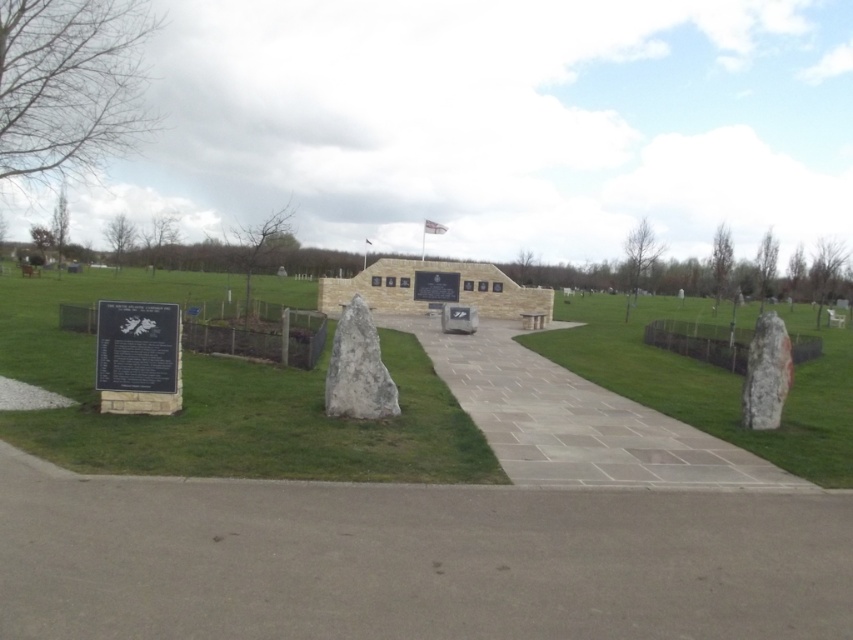
You are a gardener planning to mow the green grass at center and the gray stone path at center. Which area requires mowing?

The green grass at center requires mowing since it is taller than the gray stone path at center, which is likely a paved area and doesn

You are planning to place a small garden ornament that requires a 2 square meter space. Based on the image, can the green grass at center and the gray stone path at center accommodate this ornament?

The green grass at center has a larger size compared to gray stone path at center. Since the ornament requires 2 square meters, the green grass at center is more likely to have sufficient space for placement.

You are standing at the entrance of the memorial site and see the green grass at center and the black polished stone plaque at lower left. Which object is positioned to the left of the other?

The green grass at center is to the left of the black polished stone plaque at lower left.